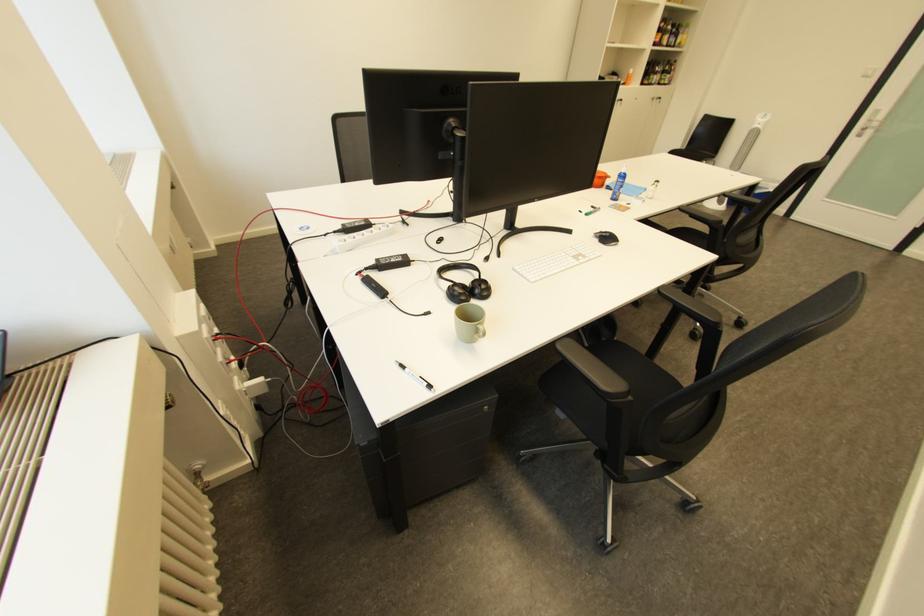
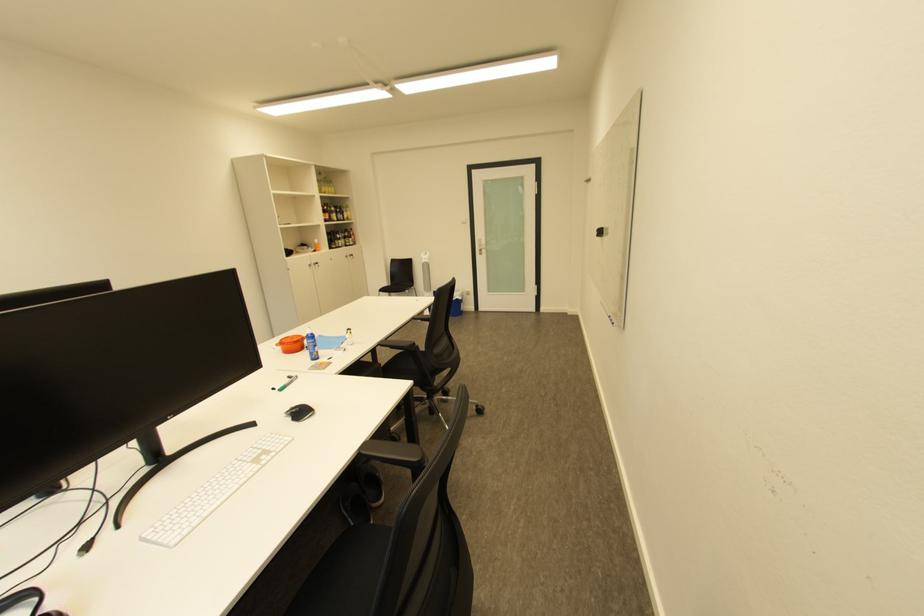
Find the pixel in the second image that matches (x=611, y=187) in the first image.

(311, 350)